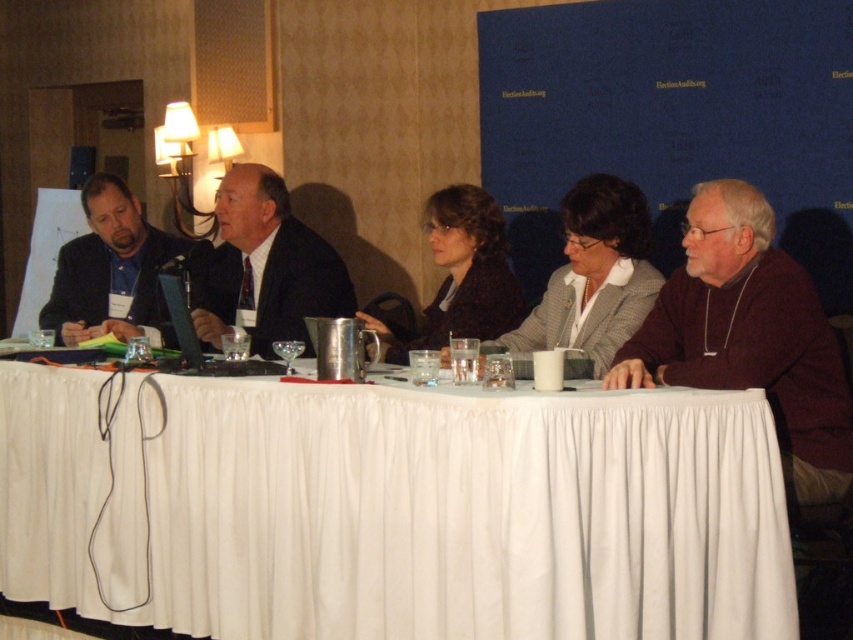
Question: Estimate the real-world distances between objects in this image. Which object is farther from the white fabric tablecloth at lower center?

Choices:
 (A) matte black suit at left
 (B) white textured blazer at center

Answer: (A)

Question: Is white fabric tablecloth at lower center smaller than dark brown textured sweater at center?

Choices:
 (A) no
 (B) yes

Answer: (A)

Question: Is white fabric tablecloth at lower center positioned before white textured blazer at center?

Choices:
 (A) no
 (B) yes

Answer: (B)

Question: Which object is closer to the camera taking this photo?

Choices:
 (A) matte black suit at left
 (B) dark suit at center
 (C) white fabric tablecloth at lower center

Answer: (C)

Question: Estimate the real-world distances between objects in this image. Which object is closer to the white textured blazer at center?

Choices:
 (A) white fabric tablecloth at lower center
 (B) matte black suit at left
 (C) dark brown textured sweater at center

Answer: (C)

Question: Does maroon sweater at right have a smaller size compared to dark suit at center?

Choices:
 (A) no
 (B) yes

Answer: (A)